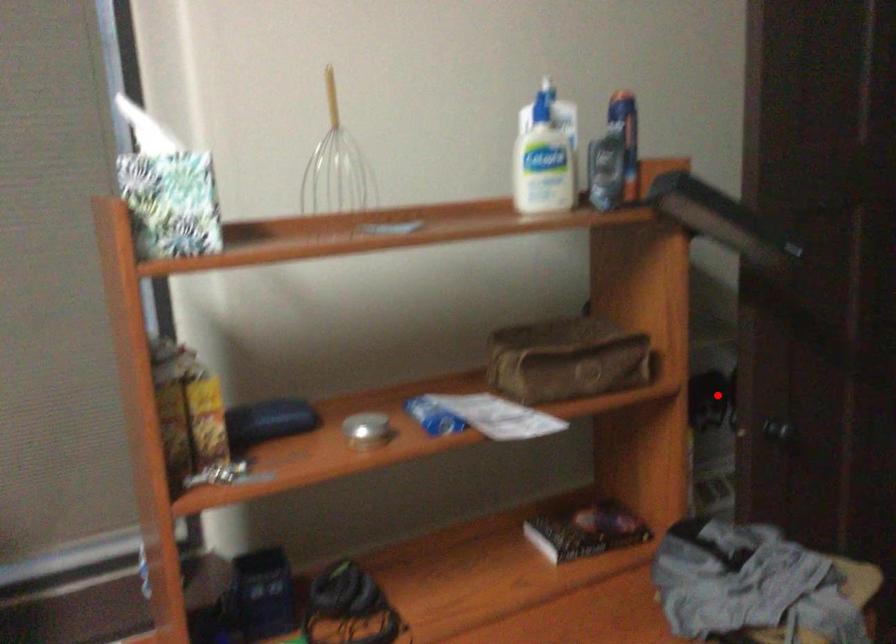
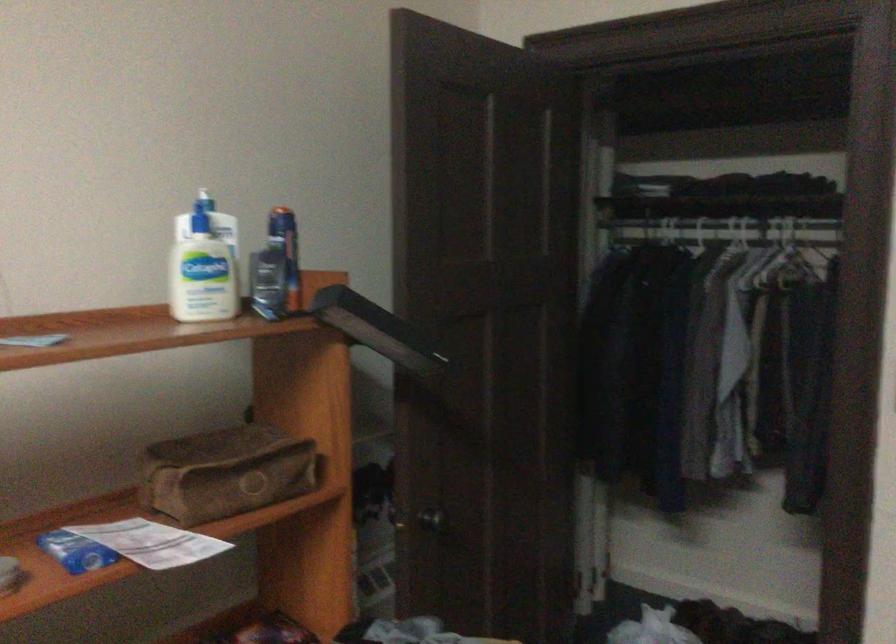
The point at the highlighted location is marked in the first image. Where is the corresponding point in the second image?

(373, 491)